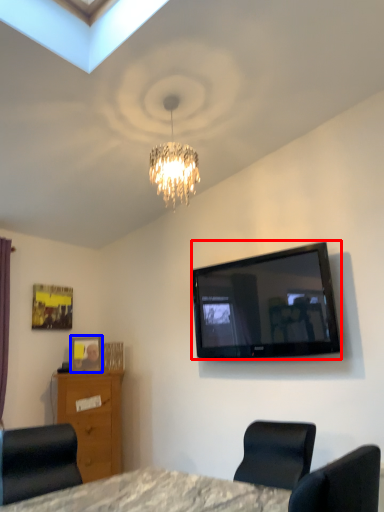
Question: Which object is further to the camera taking this photo, television (highlighted by a red box) or picture frame (highlighted by a blue box)?

Choices:
 (A) television
 (B) picture frame

Answer: (B)